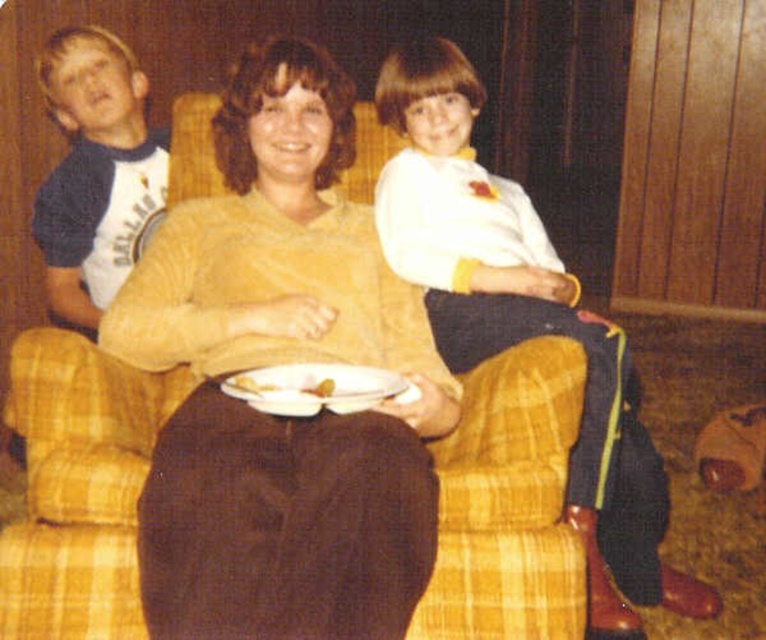
Question: Which of these objects is positioned farthest from the white glossy plate at center?

Choices:
 (A) blue-gray jersey at left
 (B) brown fabric at center
 (C) white matte plate at center
 (D) yellow plaid couch at center

Answer: (A)

Question: Can you confirm if yellow plaid couch at center is bigger than blue-gray jersey at left?

Choices:
 (A) no
 (B) yes

Answer: (A)

Question: Among these objects, which one is farthest from the camera?

Choices:
 (A) yellow matte plate at center
 (B) blue-gray jersey at left
 (C) white glossy plate at center
 (D) yellow plaid couch at center

Answer: (B)

Question: Which object is positioned closest to the yellow plaid couch at center?

Choices:
 (A) yellow matte plate at center
 (B) white cotton shirt at upper right

Answer: (A)

Question: Does yellow plaid couch at center have a greater width compared to white glossy plate at center?

Choices:
 (A) yes
 (B) no

Answer: (B)

Question: Can you confirm if yellow plaid couch at center is positioned above blue-gray jersey at left?

Choices:
 (A) yes
 (B) no

Answer: (B)